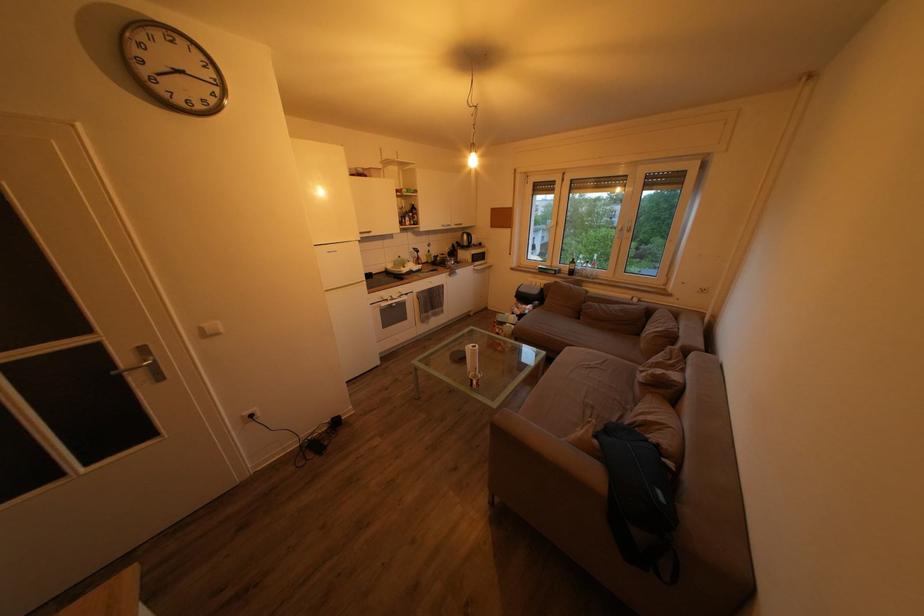
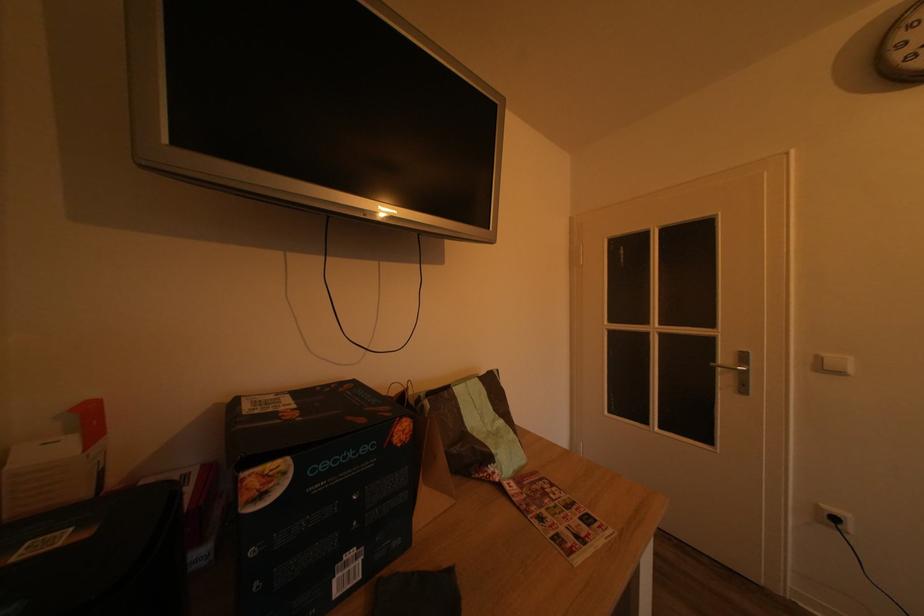
In the second image, find the point that corresponds to pixel 260 422 in the first image.

(843, 525)